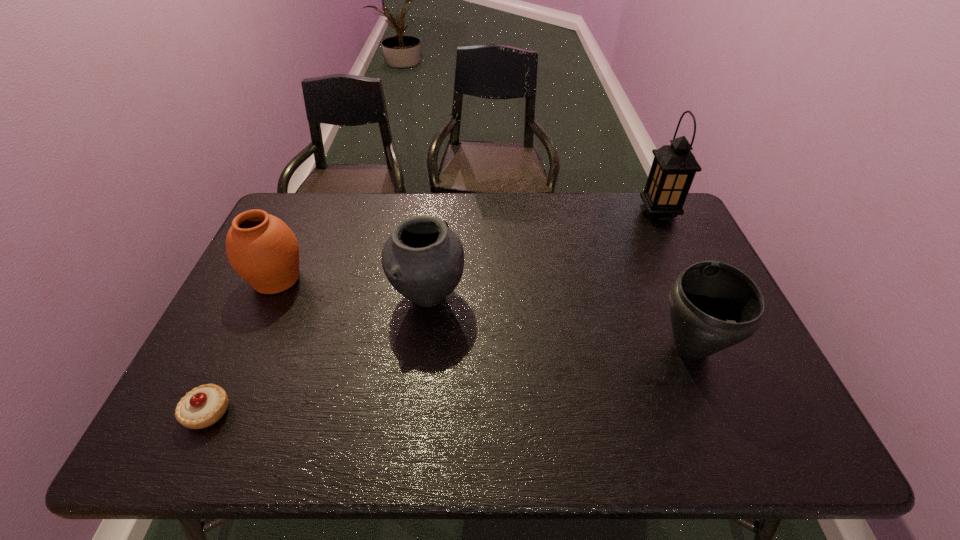
The height and width of the screenshot is (540, 960). I want to click on free space located 0.110m on the right of the leftmost urn, so click(x=345, y=279).

Locate an element on the screen. The image size is (960, 540). vacant space located on the right of the pastry is located at coordinates (392, 412).

I want to click on object present at the far edge, so click(x=674, y=166).

The image size is (960, 540). In order to click on object at the near edge in this screenshot , I will do `click(203, 406)`.

Locate an element on the screen. urn at the left edge is located at coordinates (261, 248).

Where is `pastry that is at the left edge`? The width and height of the screenshot is (960, 540). pastry that is at the left edge is located at coordinates (203, 406).

I want to click on lantern that is positioned at the right edge, so click(x=674, y=166).

At what (x,y) coordinates should I click in order to perform the action: click on urn that is at the right edge. Please return your answer as a coordinate pair (x, y). The width and height of the screenshot is (960, 540). Looking at the image, I should click on (713, 305).

This screenshot has height=540, width=960. Identify the location of object present at the near left corner. (203, 406).

Where is `object that is at the far right corner`? This screenshot has height=540, width=960. object that is at the far right corner is located at coordinates (674, 166).